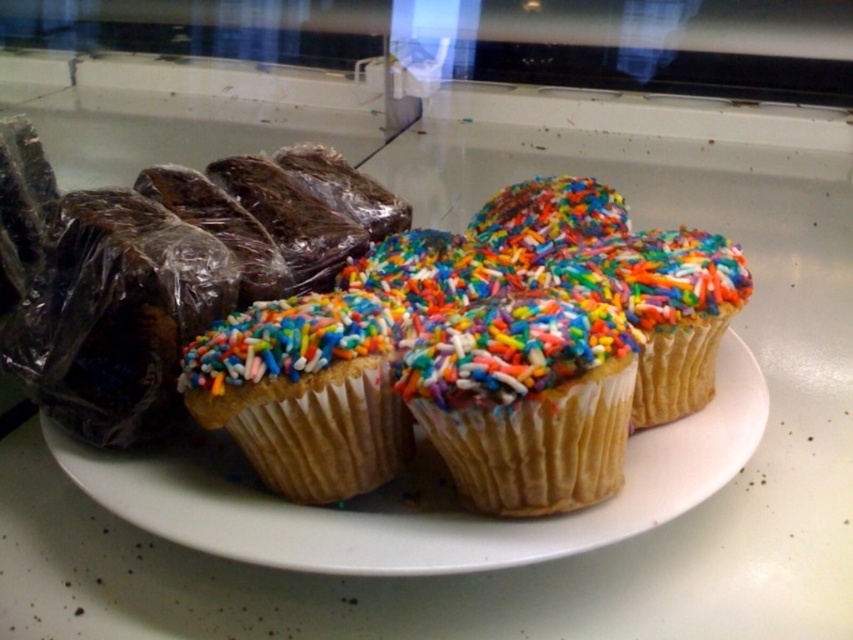
Between point (427, 349) and point (244, 412), which one is positioned behind?

The point (244, 412) is behind.

Measure the distance between multicolored sprinkles cupcake at center and matte paper cupcake at center.

They are 6.02 inches apart.

Image resolution: width=853 pixels, height=640 pixels. Identify the location of multicolored sprinkles cupcake at center. (525, 401).

Locate an element on the screen. The height and width of the screenshot is (640, 853). multicolored sprinkles cupcake at center is located at coordinates (525, 401).

Does white paper cupcake with colorful sprinkles at center come in front of matte paper cupcake at center?

Yes, white paper cupcake with colorful sprinkles at center is closer to the viewer.

Is white paper cupcake with colorful sprinkles at center further to the viewer compared to matte paper cupcake at center?

That is False.

Between point (490, 509) and point (339, 500), which one is positioned behind?

Positioned behind is point (339, 500).

Locate an element on the screen. Image resolution: width=853 pixels, height=640 pixels. white paper cupcake with colorful sprinkles at center is located at coordinates (561, 340).

Between white paper cupcake with colorful sprinkles at center and multicolored sprinkles cupcake at center, which one appears on the left side from the viewer's perspective?

white paper cupcake with colorful sprinkles at center is more to the left.

At what (x,y) coordinates should I click in order to perform the action: click on white paper cupcake with colorful sprinkles at center. Please return your answer as a coordinate pair (x, y). This screenshot has height=640, width=853. Looking at the image, I should click on (561, 340).